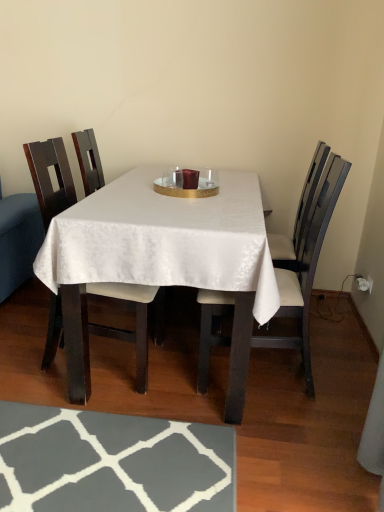
The image size is (384, 512). I want to click on free location in front of wooden chair at center, which is the 2th chair in left-to-right order, so click(x=273, y=452).